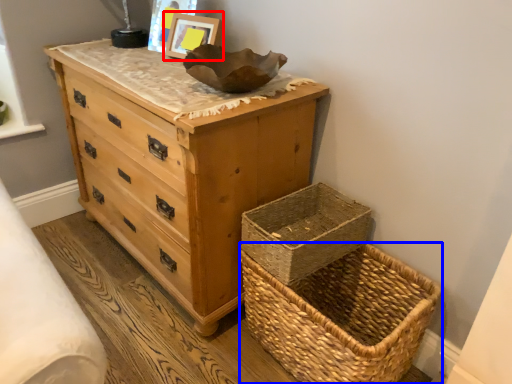
Question: Which point is further to the camera, picture frame (highlighted by a red box) or picnic basket (highlighted by a blue box)?

Choices:
 (A) picture frame
 (B) picnic basket

Answer: (A)